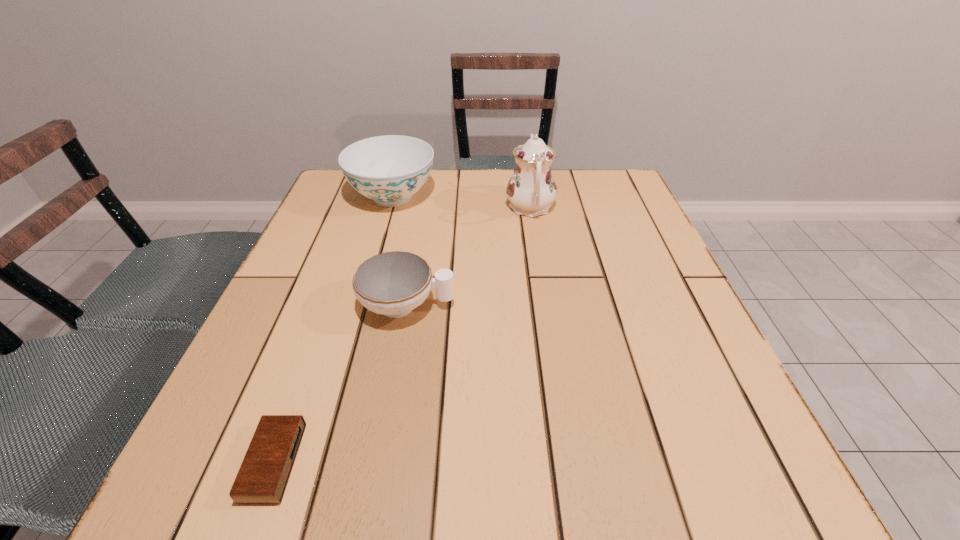
Where is `the tallest chinaware`? The width and height of the screenshot is (960, 540). the tallest chinaware is located at coordinates (531, 190).

Identify the location of the rightmost object. The height and width of the screenshot is (540, 960). (531, 190).

Where is `the second tallest object`? The height and width of the screenshot is (540, 960). the second tallest object is located at coordinates (389, 169).

Locate an element on the screen. The width and height of the screenshot is (960, 540). the shortest chinaware is located at coordinates (394, 283).

The image size is (960, 540). In order to click on the third tallest object in this screenshot , I will do `click(394, 283)`.

Identify the location of alarm clock. (263, 476).

Find the location of a particular element. This screenshot has width=960, height=540. the nearest object is located at coordinates (263, 476).

Identify the location of free space located on the front of the rightmost object. (553, 348).

I want to click on vacant point located on the front of the third shortest object, so click(362, 303).

At what (x,y) coordinates should I click in order to perform the action: click on vacant area situated on the side with the handle of the second nearest object. Please return your answer as a coordinate pair (x, y). This screenshot has height=540, width=960. Looking at the image, I should click on (565, 305).